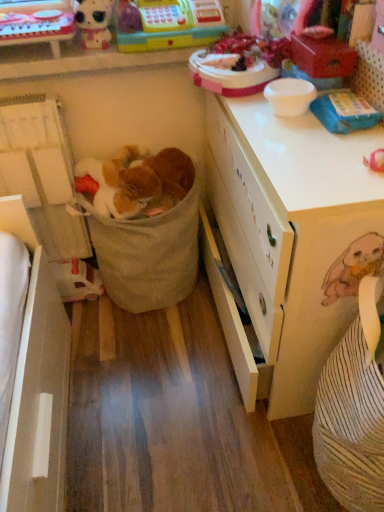
This screenshot has width=384, height=512. Describe the element at coordinates (174, 25) in the screenshot. I see `plastic toy cash register at upper center, the second toy in the top-to-bottom sequence` at that location.

Describe the element at coordinates (296, 233) in the screenshot. I see `white matte desk at center` at that location.

Measure the distance between matte plastic doll at upper left, placed as the 1th toy when sorted from top to bottom, and camera.

matte plastic doll at upper left, placed as the 1th toy when sorted from top to bottom, is 4.08 feet from camera.

This screenshot has height=512, width=384. I want to click on matte plastic doll at upper left, placed as the 1th toy when sorted from top to bottom, so (94, 22).

Measure the distance between beige fabric laundry basket at center and camera.

beige fabric laundry basket at center is 4.39 feet from camera.

Measure the distance between point (x=112, y=181) and camera.

4.48 feet.

Where is `matte plastic toy at upper left`? matte plastic toy at upper left is located at coordinates (36, 22).

Considering the points (208, 12) and (180, 189), which point is behind, point (208, 12) or point (180, 189)?

Positioned behind is point (180, 189).

Can you confirm if plastic toy cash register at upper center, arranged as the third toy when ordered from the bottom, is taller than burlap sack at center, the third toy viewed from the top?

Yes.

From the image's perspective, is plastic toy cash register at upper center, the second toy in the top-to-bottom sequence, located beneath burlap sack at center, the third toy viewed from the top?

No.

Is the surface of plastic toy cash register at upper center, arranged as the third toy when ordered from the bottom, in direct contact with burlap sack at center, acting as the 2th toy starting from the bottom?

They are not placed beside each other.

Consider the image. Considering the positions of objects white plastic toy at lower left, the fourth toy from the top, and burlap sack at center, the third toy viewed from the top, in the image provided, who is more to the right, white plastic toy at lower left, the fourth toy from the top, or burlap sack at center, the third toy viewed from the top,?

burlap sack at center, the third toy viewed from the top, is more to the right.

Measure the distance from white plastic toy at lower left, the fourth toy from the top, to burlap sack at center, the third toy viewed from the top.

They are 16.02 inches apart.

From the image's perspective, which is below, white plastic toy at lower left, the fourth toy from the top, or burlap sack at center, the third toy viewed from the top?

white plastic toy at lower left, the fourth toy from the top, is shown below in the image.

In order to click on toy located behind the burlap sack at center, the third toy viewed from the top in this screenshot , I will do `click(76, 280)`.

Which is closer, (180, 151) or (313, 343)?

Point (180, 151) is positioned farther from the camera compared to point (313, 343).

Consider the image. In terms of width, does burlap sack at center, acting as the 2th toy starting from the bottom, look wider or thinner when compared to white matte desk at center?

burlap sack at center, acting as the 2th toy starting from the bottom, is thinner than white matte desk at center.

From the image's perspective, is burlap sack at center, the third toy viewed from the top, below white matte desk at center?

No, from the image's perspective, burlap sack at center, the third toy viewed from the top, is not beneath white matte desk at center.

Locate an element on the screen. the 2nd toy to the left when counting from the white matte desk at center is located at coordinates (138, 181).

Can you confirm if matte plastic doll at upper left, which ranks as the 4th toy in bottom-to-top order, is wider than white matte desk at center?

In fact, matte plastic doll at upper left, which ranks as the 4th toy in bottom-to-top order, might be narrower than white matte desk at center.

Is point (89, 23) farther from camera compared to point (313, 392)?

Yes, point (89, 23) is behind point (313, 392).

Is white matte desk at center located within matte plastic doll at upper left, placed as the 1th toy when sorted from top to bottom?

That's incorrect, white matte desk at center is not inside matte plastic doll at upper left, placed as the 1th toy when sorted from top to bottom.

Considering the sizes of matte plastic doll at upper left, which ranks as the 4th toy in bottom-to-top order, and white matte desk at center in the image, is matte plastic doll at upper left, which ranks as the 4th toy in bottom-to-top order, taller or shorter than white matte desk at center?

Considering their sizes, matte plastic doll at upper left, which ranks as the 4th toy in bottom-to-top order, has less height than white matte desk at center.

Visually, is burlap sack at center, the third toy viewed from the top, positioned to the left or to the right of matte plastic toy at upper left?

From the image, it's evident that burlap sack at center, the third toy viewed from the top, is to the right of matte plastic toy at upper left.

Based on the photo, can you confirm if burlap sack at center, the third toy viewed from the top, is smaller than matte plastic toy at upper left?

Actually, burlap sack at center, the third toy viewed from the top, might be larger than matte plastic toy at upper left.

Could you measure the distance between burlap sack at center, acting as the 2th toy starting from the bottom, and matte plastic toy at upper left?

17.26 inches.

Is beige fabric laundry basket at center completely or partially inside plastic toy cash register at upper center, the second toy in the top-to-bottom sequence?

No, beige fabric laundry basket at center is located outside of plastic toy cash register at upper center, the second toy in the top-to-bottom sequence.

Is plastic toy cash register at upper center, arranged as the third toy when ordered from the bottom, turned away from beige fabric laundry basket at center?

No, plastic toy cash register at upper center, arranged as the third toy when ordered from the bottom,'s orientation is not away from beige fabric laundry basket at center.

From a real-world perspective, relative to beige fabric laundry basket at center, is plastic toy cash register at upper center, the second toy in the top-to-bottom sequence, vertically above or below?

In terms of real-world spatial position, plastic toy cash register at upper center, the second toy in the top-to-bottom sequence, is above beige fabric laundry basket at center.

Considering the positions of point (206, 44) and point (184, 219), is point (206, 44) closer or farther from the camera than point (184, 219)?

Point (206, 44) is closer to the camera than point (184, 219).

Can you confirm if matte plastic doll at upper left, placed as the 1th toy when sorted from top to bottom, is positioned to the right of white plastic toy at lower left, the fourth toy from the top?

Indeed, matte plastic doll at upper left, placed as the 1th toy when sorted from top to bottom, is positioned on the right side of white plastic toy at lower left, the fourth toy from the top.

Considering the points (104, 21) and (89, 270), which point is behind, point (104, 21) or point (89, 270)?

The point (89, 270) is farther.

Is matte plastic doll at upper left, placed as the 1th toy when sorted from top to bottom, positioned with its back to white plastic toy at lower left, the fourth toy from the top?

No, matte plastic doll at upper left, placed as the 1th toy when sorted from top to bottom, is not facing the opposite direction of white plastic toy at lower left, the fourth toy from the top.

From the image's perspective, which one is positioned higher, matte plastic doll at upper left, placed as the 1th toy when sorted from top to bottom, or white plastic toy at lower left, the fourth toy from the top?

matte plastic doll at upper left, placed as the 1th toy when sorted from top to bottom, appears higher in the image.

Where is `the 1st toy directly above the burlap sack at center, acting as the 2th toy starting from the bottom (from a real-world perspective)`? The width and height of the screenshot is (384, 512). the 1st toy directly above the burlap sack at center, acting as the 2th toy starting from the bottom (from a real-world perspective) is located at coordinates (174, 25).

Identify the location of the 2nd toy counting from the right of the white plastic toy at lower left, placed as the first toy when sorted from bottom to top. The width and height of the screenshot is (384, 512). (138, 181).

Based on their spatial positions, is white matte desk at center or matte plastic toy at upper left further from matte plastic doll at upper left, which ranks as the 4th toy in bottom-to-top order?

white matte desk at center.

Based on their spatial positions, is beige fabric laundry basket at center or matte plastic toy at upper left closer to white plastic toy at lower left, the fourth toy from the top?

Based on the image, beige fabric laundry basket at center appears to be nearer to white plastic toy at lower left, the fourth toy from the top.

From the image, which object appears to be farther from beige fabric laundry basket at center, burlap sack at center, acting as the 2th toy starting from the bottom, or plastic toy cash register at upper center, the second toy in the top-to-bottom sequence?

plastic toy cash register at upper center, the second toy in the top-to-bottom sequence, is positioned further to the anchor beige fabric laundry basket at center.

When comparing their distances from matte plastic toy at upper left, does burlap sack at center, acting as the 2th toy starting from the bottom, or white matte desk at center seem further?

white matte desk at center is further to matte plastic toy at upper left.

Based on their spatial positions, is beige fabric laundry basket at center or white matte desk at center further from burlap sack at center, acting as the 2th toy starting from the bottom?

white matte desk at center is further to burlap sack at center, acting as the 2th toy starting from the bottom.

Based on their spatial positions, is matte plastic doll at upper left, placed as the 1th toy when sorted from top to bottom, or beige fabric laundry basket at center further from plastic toy cash register at upper center, the second toy in the top-to-bottom sequence?

beige fabric laundry basket at center is further to plastic toy cash register at upper center, the second toy in the top-to-bottom sequence.

From the image, which object appears to be farther from white matte desk at center, matte plastic doll at upper left, placed as the 1th toy when sorted from top to bottom, or beige fabric laundry basket at center?

matte plastic doll at upper left, placed as the 1th toy when sorted from top to bottom, lies further to white matte desk at center than the other object.

Looking at the image, which one is located closer to burlap sack at center, the third toy viewed from the top, beige fabric laundry basket at center or white plastic toy at lower left, the fourth toy from the top?

beige fabric laundry basket at center lies closer to burlap sack at center, the third toy viewed from the top, than the other object.

In order to click on laundry basket between matte plastic toy at upper left and white plastic toy at lower left, the fourth toy from the top, vertically in this screenshot , I will do `click(148, 254)`.

Locate an element on the screen. laundry basket between matte plastic doll at upper left, which ranks as the 4th toy in bottom-to-top order, and white plastic toy at lower left, the fourth toy from the top, from top to bottom is located at coordinates (148, 254).

Where is `desk between matte plastic doll at upper left, placed as the 1th toy when sorted from top to bottom, and beige fabric laundry basket at center vertically`? This screenshot has width=384, height=512. desk between matte plastic doll at upper left, placed as the 1th toy when sorted from top to bottom, and beige fabric laundry basket at center vertically is located at coordinates (296, 233).

I want to click on cabinetry between matte plastic doll at upper left, which ranks as the 4th toy in bottom-to-top order, and burlap sack at center, acting as the 2th toy starting from the bottom, vertically, so click(x=36, y=22).